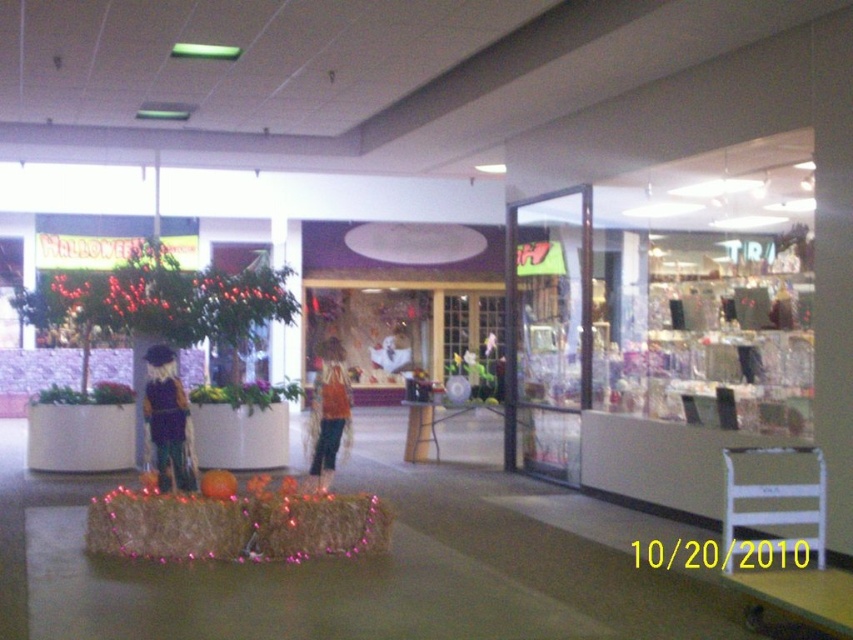
Question: Can you confirm if matte brown scarecrow at center is positioned to the left of orange fabric dress at center?

Choices:
 (A) no
 (B) yes

Answer: (B)

Question: Where is matte brown scarecrow at center located in relation to orange fabric dress at center in the image?

Choices:
 (A) below
 (B) above

Answer: (A)

Question: Which object appears farthest from the camera in this image?

Choices:
 (A) matte brown scarecrow at center
 (B) orange fabric dress at center

Answer: (B)

Question: Among these points, which one is nearest to the camera?

Choices:
 (A) (325, 436)
 (B) (160, 380)

Answer: (B)

Question: Among these objects, which one is farthest from the camera?

Choices:
 (A) matte brown scarecrow at center
 (B) orange fabric dress at center

Answer: (B)

Question: Does matte brown scarecrow at center have a lesser width compared to orange fabric dress at center?

Choices:
 (A) yes
 (B) no

Answer: (A)